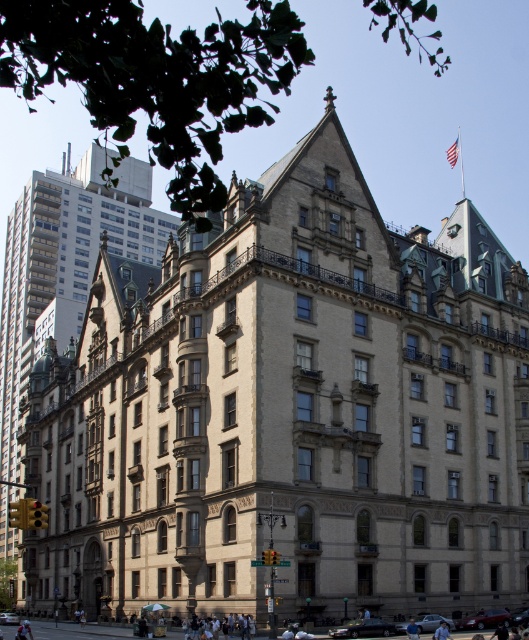
Question: Where is stone building at center located in relation to metallic silver car at center in the image?

Choices:
 (A) above
 (B) below

Answer: (A)

Question: Is silver metallic sedan at lower center thinner than metallic silver car at center?

Choices:
 (A) no
 (B) yes

Answer: (B)

Question: Which of these objects is positioned closest to the metallic silver car at center?

Choices:
 (A) stone building at center
 (B) metallic red car at lower right

Answer: (B)

Question: Which point appears closest to the camera in this image?

Choices:
 (A) (512, 612)
 (B) (369, 632)
 (C) (8, 621)
 (D) (479, 611)

Answer: (B)

Question: Which of the following is the farthest from the observer?

Choices:
 (A) [478, 618]
 (B) [525, 605]
 (C) [355, 630]
 (D) [45, 237]

Answer: (D)

Question: Does shiny black sedan at lower center have a larger size compared to metallic silver car at center?

Choices:
 (A) no
 (B) yes

Answer: (A)